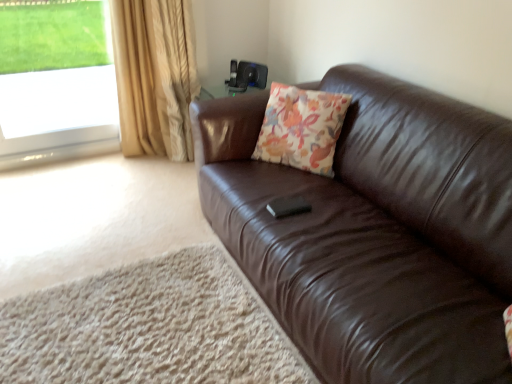
Question: Is brown leather couch at right further to the viewer compared to floral fabric cushion at center?

Choices:
 (A) no
 (B) yes

Answer: (A)

Question: Is floral fabric cushion at center completely or partially inside brown leather couch at right?

Choices:
 (A) no
 (B) yes

Answer: (B)

Question: Considering the relative sizes of brown leather couch at right and floral fabric cushion at center in the image provided, is brown leather couch at right bigger than floral fabric cushion at center?

Choices:
 (A) no
 (B) yes

Answer: (B)

Question: Is brown leather couch at right smaller than floral fabric cushion at center?

Choices:
 (A) no
 (B) yes

Answer: (A)

Question: Can you confirm if brown leather couch at right is wider than floral fabric cushion at center?

Choices:
 (A) no
 (B) yes

Answer: (B)

Question: From a real-world perspective, is transparent glass window at upper left above or below floral fabric cushion at center?

Choices:
 (A) above
 (B) below

Answer: (A)

Question: Based on their positions, is transparent glass window at upper left located to the left or right of floral fabric cushion at center?

Choices:
 (A) left
 (B) right

Answer: (A)

Question: In terms of height, does transparent glass window at upper left look taller or shorter compared to floral fabric cushion at center?

Choices:
 (A) tall
 (B) short

Answer: (A)

Question: Considering the positions of transparent glass window at upper left and floral fabric cushion at center in the image, is transparent glass window at upper left wider or thinner than floral fabric cushion at center?

Choices:
 (A) thin
 (B) wide

Answer: (A)

Question: From the image's perspective, is gold textured curtain at left positioned above or below floral fabric cushion at center?

Choices:
 (A) above
 (B) below

Answer: (A)

Question: From a real-world perspective, relative to floral fabric cushion at center, is gold textured curtain at left vertically above or below?

Choices:
 (A) above
 (B) below

Answer: (B)

Question: Based on their sizes in the image, would you say gold textured curtain at left is bigger or smaller than floral fabric cushion at center?

Choices:
 (A) small
 (B) big

Answer: (B)

Question: Is gold textured curtain at left in front of or behind floral fabric cushion at center in the image?

Choices:
 (A) front
 (B) behind

Answer: (B)

Question: Does point (179, 157) appear closer or farther from the camera than point (98, 67)?

Choices:
 (A) farther
 (B) closer

Answer: (A)

Question: In terms of height, does gold textured curtain at left look taller or shorter compared to transparent glass window at upper left?

Choices:
 (A) tall
 (B) short

Answer: (A)